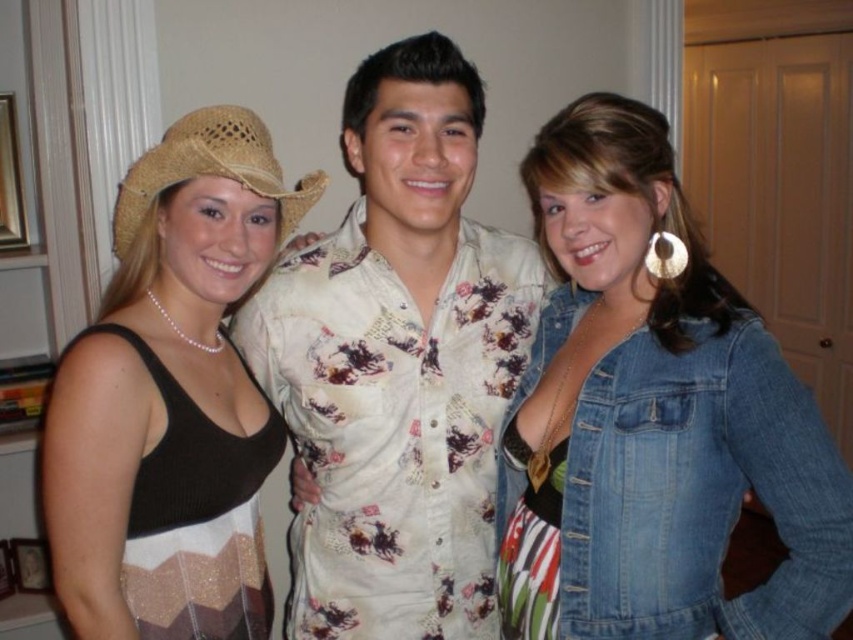
Question: Can you confirm if denim jacket at lower right is positioned to the left of white printed shirt at center?

Choices:
 (A) yes
 (B) no

Answer: (B)

Question: Which of the following is the farthest from the observer?

Choices:
 (A) (498, 362)
 (B) (132, 426)
 (C) (764, 474)

Answer: (A)

Question: Among these objects, which one is nearest to the camera?

Choices:
 (A) white printed shirt at center
 (B) matte straw cowboy hat at left

Answer: (B)

Question: Can you confirm if denim jacket at lower right is thinner than black knitted dress at left?

Choices:
 (A) yes
 (B) no

Answer: (B)

Question: Which is farther from the black knitted dress at left?

Choices:
 (A) white printed shirt at center
 (B) matte straw cowboy hat at left
 (C) denim jacket at lower right

Answer: (C)

Question: Considering the relative positions of denim jacket at lower right and white printed shirt at center in the image provided, where is denim jacket at lower right located with respect to white printed shirt at center?

Choices:
 (A) above
 (B) below

Answer: (B)